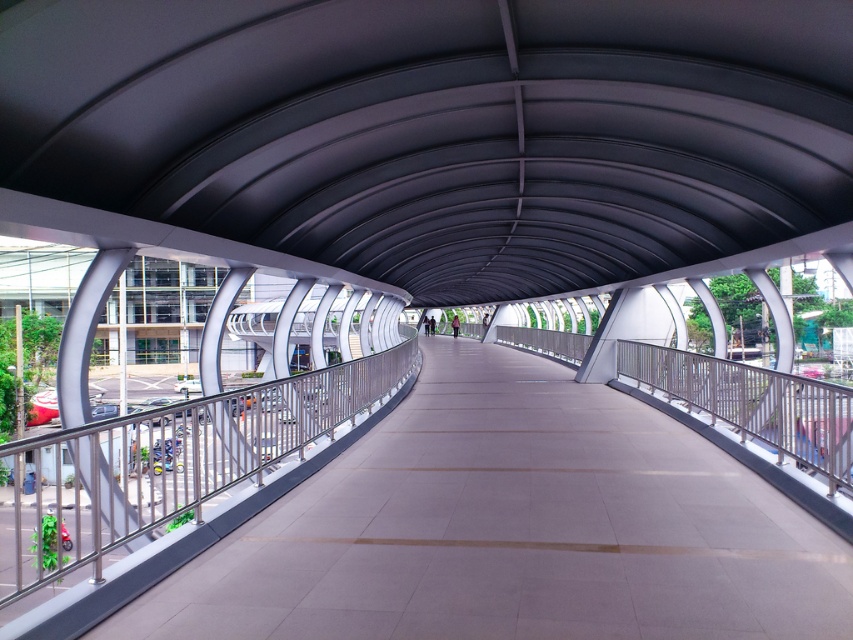
Question: Which object is closer to the camera taking this photo?

Choices:
 (A) satin silver railing at center
 (B) satin silver railing at left
 (C) satin concrete walkway at center

Answer: (B)

Question: Which point appears farthest from the camera in this image?

Choices:
 (A) (407, 532)
 (B) (321, 432)

Answer: (B)

Question: Can you confirm if satin concrete walkway at center is positioned to the right of satin silver railing at center?

Choices:
 (A) yes
 (B) no

Answer: (B)

Question: Does satin silver railing at left appear on the right side of satin silver railing at center?

Choices:
 (A) no
 (B) yes

Answer: (A)

Question: Which of the following is the farthest from the observer?

Choices:
 (A) (331, 465)
 (B) (242, 422)

Answer: (A)

Question: Does satin concrete walkway at center appear under satin silver railing at left?

Choices:
 (A) no
 (B) yes

Answer: (A)